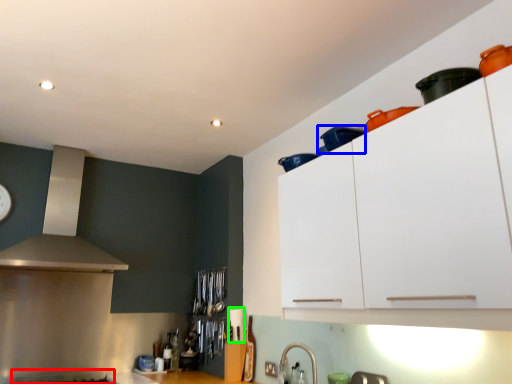
Question: Estimate the real-world distances between objects in this image. Which object is closer to gas stove (highlighted by a red box), appliance (highlighted by a blue box) or appliance (highlighted by a green box)?

Choices:
 (A) appliance
 (B) appliance

Answer: (B)